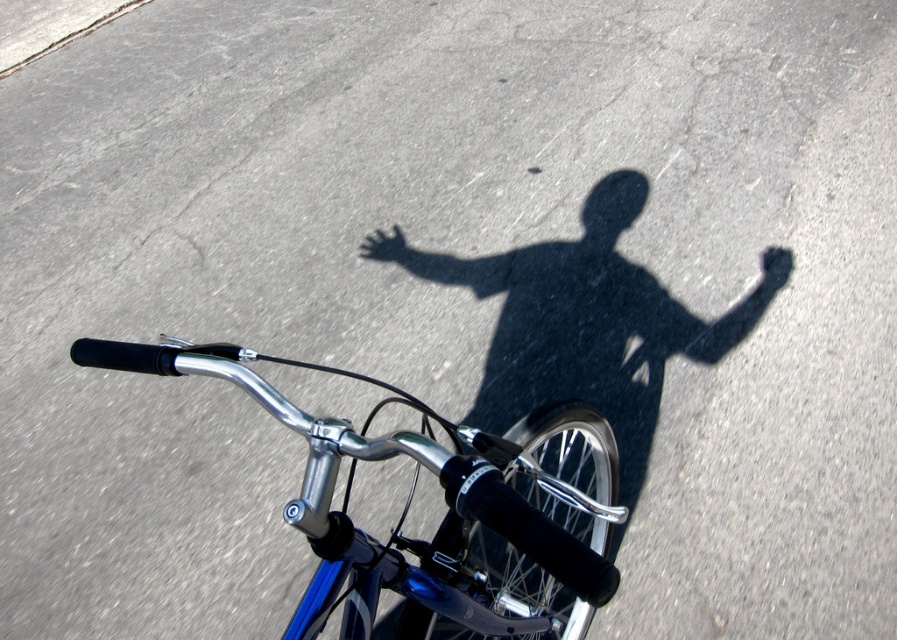
In the scene shown: Measure the distance between shiny blue bicycle handlebars at center and camera.

31.91 inches

Is point (129, 353) in front of point (395, 237)?

Yes, point (129, 353) is in front of point (395, 237).

I want to click on shiny blue bicycle handlebars at center, so click(445, 515).